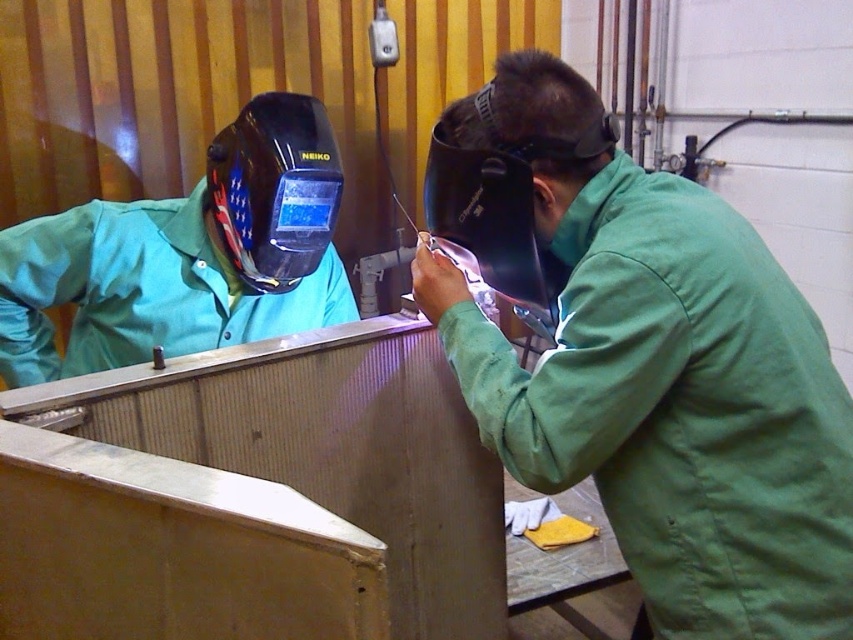
Question: Which point is closer to the camera taking this photo?

Choices:
 (A) (711, 193)
 (B) (257, 193)

Answer: (A)

Question: Does green matte welding suit at center have a greater width compared to matte black welding helmet at upper left?

Choices:
 (A) no
 (B) yes

Answer: (A)

Question: Which of the following is the closest to the observer?

Choices:
 (A) matte black welding helmet at upper left
 (B) green matte welding suit at center

Answer: (B)

Question: Which object appears farthest from the camera in this image?

Choices:
 (A) matte black welding helmet at upper left
 (B) green matte welding suit at center

Answer: (A)

Question: Can you confirm if green matte welding suit at center is positioned to the left of matte black welding helmet at upper left?

Choices:
 (A) yes
 (B) no

Answer: (B)

Question: Does green matte welding suit at center appear on the right side of matte black welding helmet at upper left?

Choices:
 (A) no
 (B) yes

Answer: (B)